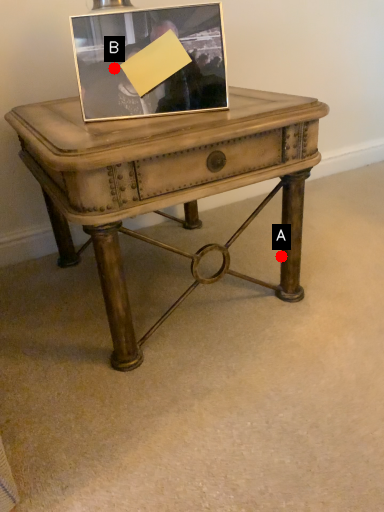
Question: Two points are circled on the image, labeled by A and B beside each circle. Which point is closer to the camera?

Choices:
 (A) A is closer
 (B) B is closer

Answer: (B)